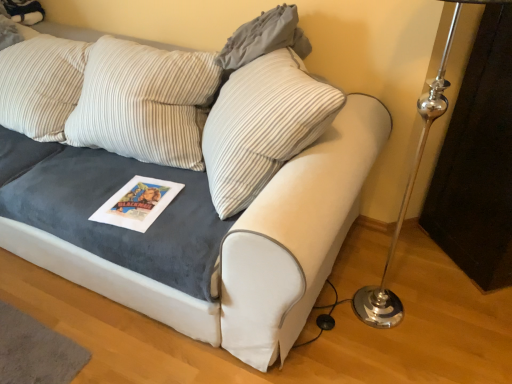
Question: From the image's perspective, is gray fabric pillow at upper center positioned above or below velvet gray couch at center?

Choices:
 (A) below
 (B) above

Answer: (B)

Question: Is gray fabric pillow at upper center wider or thinner than velvet gray couch at center?

Choices:
 (A) wide
 (B) thin

Answer: (B)

Question: From their relative heights in the image, would you say gray fabric pillow at upper center is taller or shorter than velvet gray couch at center?

Choices:
 (A) short
 (B) tall

Answer: (A)

Question: Considering the positions of point [54, 170] and point [276, 8], is point [54, 170] closer or farther from the camera than point [276, 8]?

Choices:
 (A) farther
 (B) closer

Answer: (A)

Question: Considering the positions of velvet gray couch at center and gray fabric pillow at upper center in the image, is velvet gray couch at center wider or thinner than gray fabric pillow at upper center?

Choices:
 (A) wide
 (B) thin

Answer: (A)

Question: Is velvet gray couch at center in front of or behind gray fabric pillow at upper center in the image?

Choices:
 (A) front
 (B) behind

Answer: (A)

Question: From a real-world perspective, is velvet gray couch at center positioned above or below gray fabric pillow at upper center?

Choices:
 (A) above
 (B) below

Answer: (B)